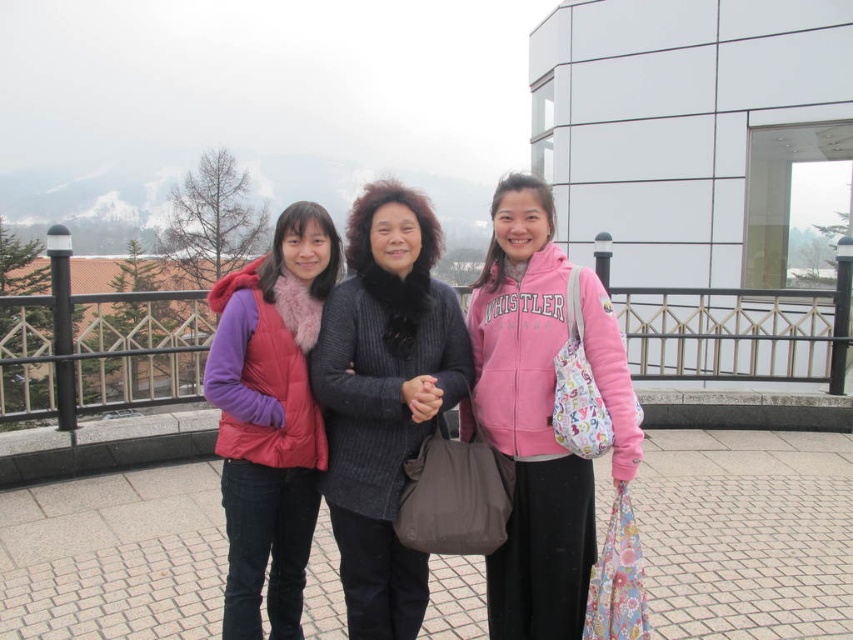
Question: Can you confirm if pink fleece jacket at center is positioned below matte pink vest at left?

Choices:
 (A) yes
 (B) no

Answer: (B)

Question: Considering the real-world distances, which object is closest to the matte pink vest at left?

Choices:
 (A) knitted gray sweater at center
 (B) pink fleece jacket at center

Answer: (A)

Question: Among these objects, which one is farthest from the camera?

Choices:
 (A) pink fleece jacket at center
 (B) matte pink vest at left

Answer: (B)

Question: Can you confirm if knitted gray sweater at center is positioned to the right of pink fleece jacket at center?

Choices:
 (A) yes
 (B) no

Answer: (B)

Question: Which of the following is the closest to the observer?

Choices:
 (A) pink fleece jacket at center
 (B) matte pink vest at left

Answer: (A)

Question: Is pink fleece jacket at center to the right of matte pink vest at left from the viewer's perspective?

Choices:
 (A) no
 (B) yes

Answer: (B)